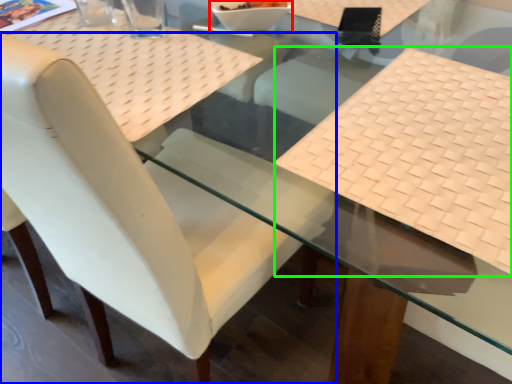
Question: Estimate the real-world distances between objects in this image. Which object is farther from glass bowl (highlighted by a red box), chair (highlighted by a blue box) or tablecloth (highlighted by a green box)?

Choices:
 (A) chair
 (B) tablecloth

Answer: (A)